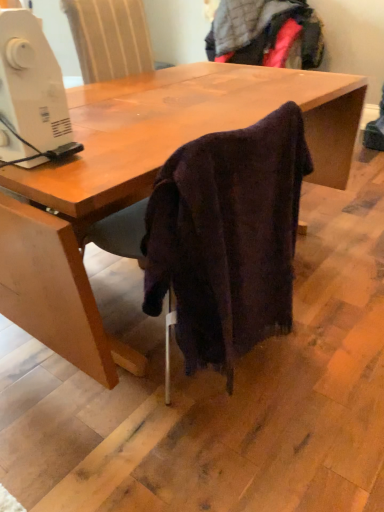
Question: From their relative heights in the image, would you say dark woolen sweater at lower center is taller or shorter than white plastic sewing machine at left?

Choices:
 (A) short
 (B) tall

Answer: (B)

Question: Looking at the image, does dark woolen sweater at lower center seem bigger or smaller compared to white plastic sewing machine at left?

Choices:
 (A) big
 (B) small

Answer: (A)

Question: In the image, is dark woolen sweater at lower center on the left side or the right side of white plastic sewing machine at left?

Choices:
 (A) left
 (B) right

Answer: (B)

Question: Is white plastic sewing machine at left bigger or smaller than dark woolen sweater at lower center?

Choices:
 (A) small
 (B) big

Answer: (A)

Question: Looking at their shapes, would you say white plastic sewing machine at left is wider or thinner than dark woolen sweater at lower center?

Choices:
 (A) thin
 (B) wide

Answer: (A)

Question: In the image, is white plastic sewing machine at left on the left side or the right side of dark woolen sweater at lower center?

Choices:
 (A) right
 (B) left

Answer: (B)

Question: From a real-world perspective, is white plastic sewing machine at left positioned above or below dark woolen sweater at lower center?

Choices:
 (A) above
 (B) below

Answer: (A)